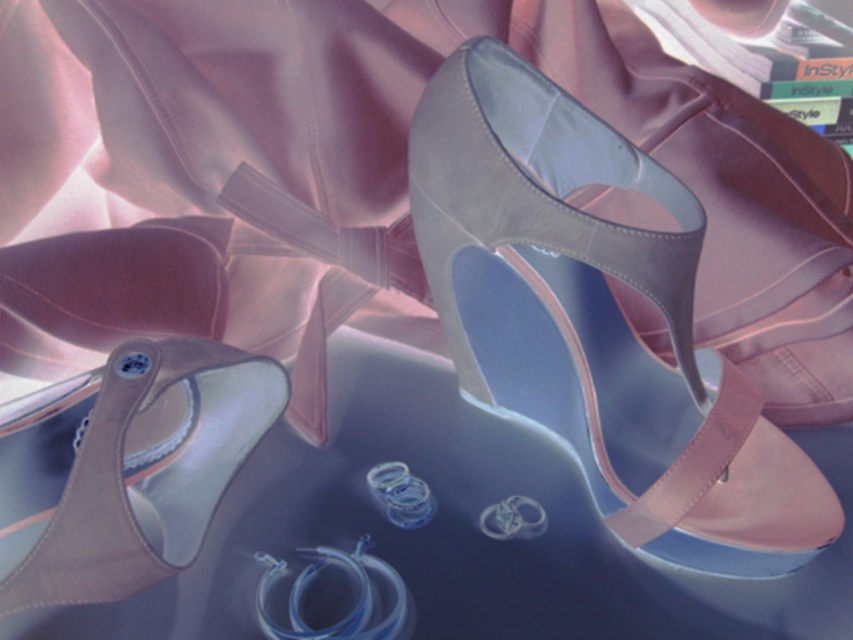
You are a photographer trying to capture a detailed shot of the point at coordinates point (683,300). Your camera has a depth of field that can focus clearly up to 100 centimeters away. Will the point be in focus?

The distance between point (683,300) and the camera is 99.36 centimeters, which is within the camera 100 centimeter focus range. Therefore, the point will be in focus.